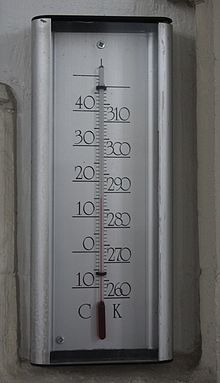
Identify the location of glass. Image resolution: width=220 pixels, height=383 pixels. (101, 258).